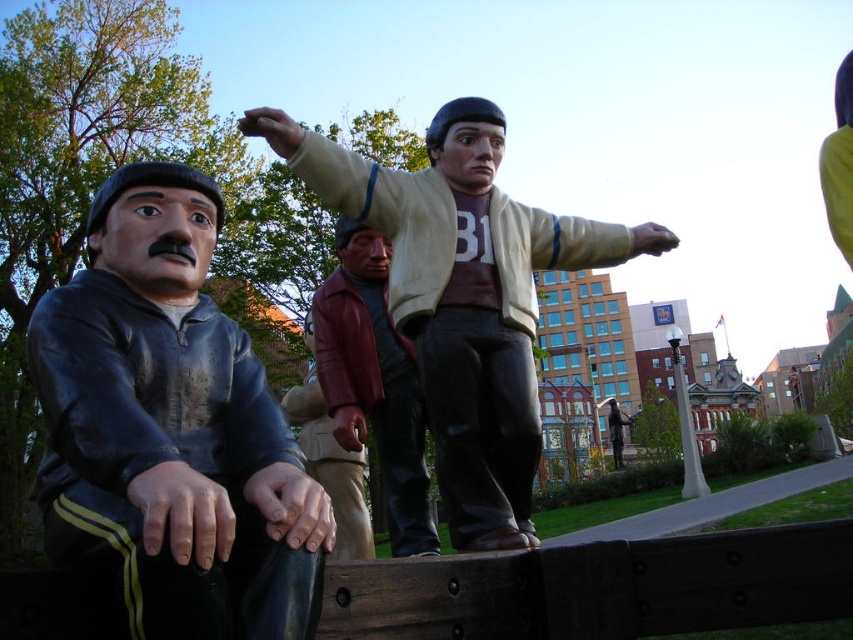
Question: Among these objects, which one is farthest from the camera?

Choices:
 (A) shiny maroon jacket at center
 (B) shiny black jacket at left
 (C) matte beige jacket at center

Answer: (A)

Question: Is matte beige jacket at center in front of shiny maroon jacket at center?

Choices:
 (A) no
 (B) yes

Answer: (B)

Question: Which object is positioned farthest from the shiny black jacket at left?

Choices:
 (A) matte beige jacket at center
 (B) shiny maroon jacket at center

Answer: (B)

Question: Does matte beige jacket at center appear on the left side of shiny maroon jacket at center?

Choices:
 (A) no
 (B) yes

Answer: (A)

Question: Among these points, which one is farthest from the camera?

Choices:
 (A) (506, 208)
 (B) (381, 243)

Answer: (B)

Question: In this image, where is shiny black jacket at left located relative to matte beige jacket at center?

Choices:
 (A) left
 (B) right

Answer: (A)